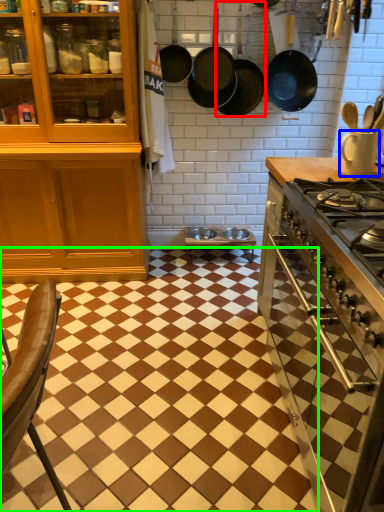
Question: Which object is the farthest from frying pan (highlighted by a red box)? Choose among these: kitchen appliance (highlighted by a blue box) or tile (highlighted by a green box).

Choices:
 (A) kitchen appliance
 (B) tile

Answer: (B)